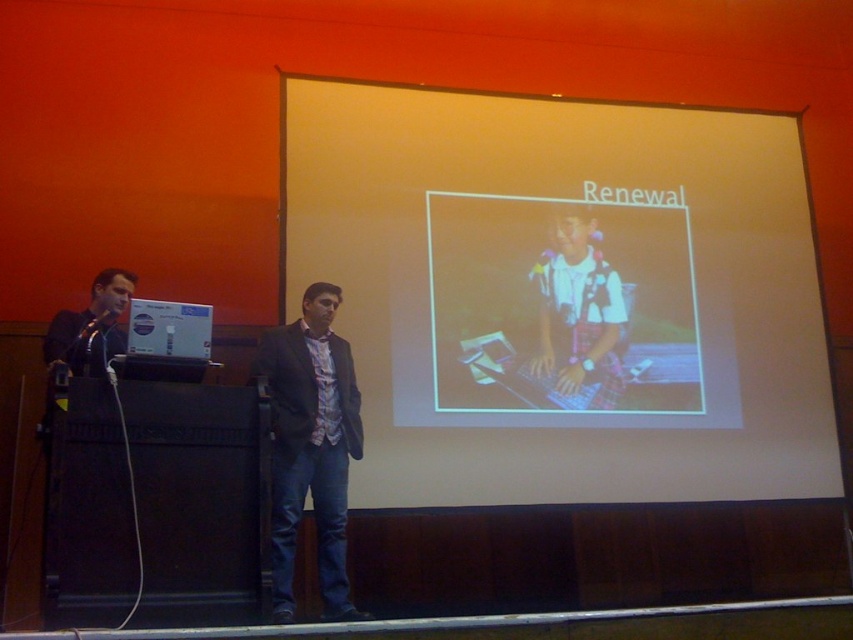
You are organizing a presentation and need to place a laptop bag on the stage. The bag requires 1.2 square feet of space. Given the sizes of the matte plastic keyboard at center and the metallic silver microphone at upper center, can you determine if there is enough space to place the bag between them?

The matte plastic keyboard at center is larger than the metallic silver microphone at upper center. However, the exact dimensions of the space between them are not provided, so it is impossible to determine if the 1.2 square feet requirement is met.